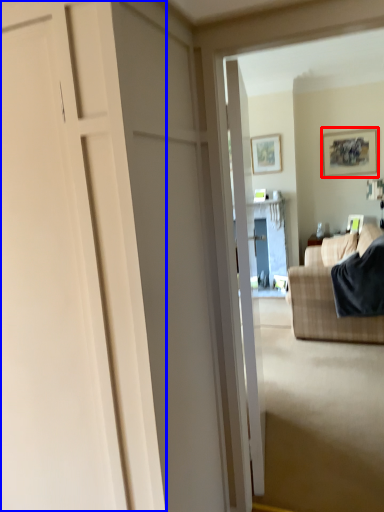
Question: Which object is further to the camera taking this photo, picture frame (highlighted by a red box) or door (highlighted by a blue box)?

Choices:
 (A) picture frame
 (B) door

Answer: (A)